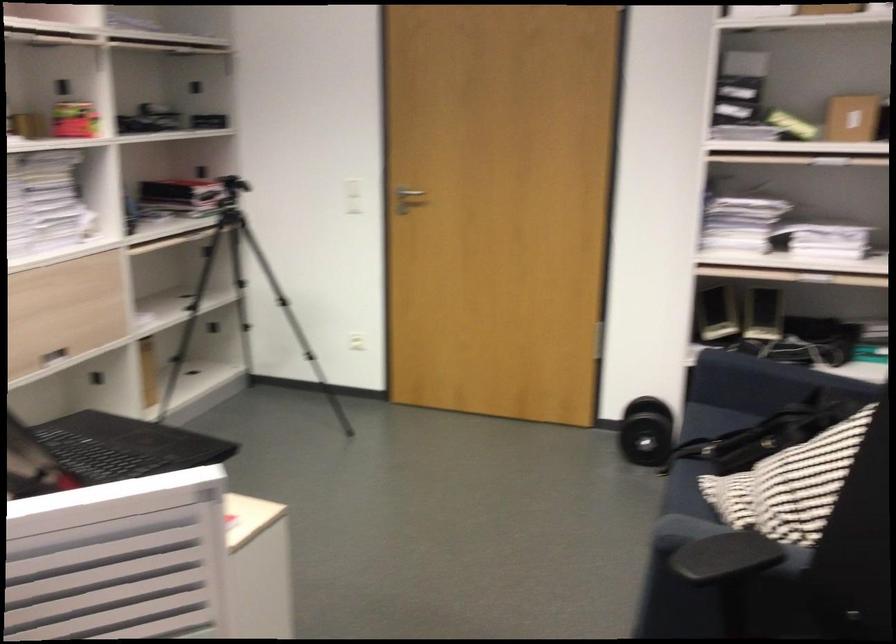
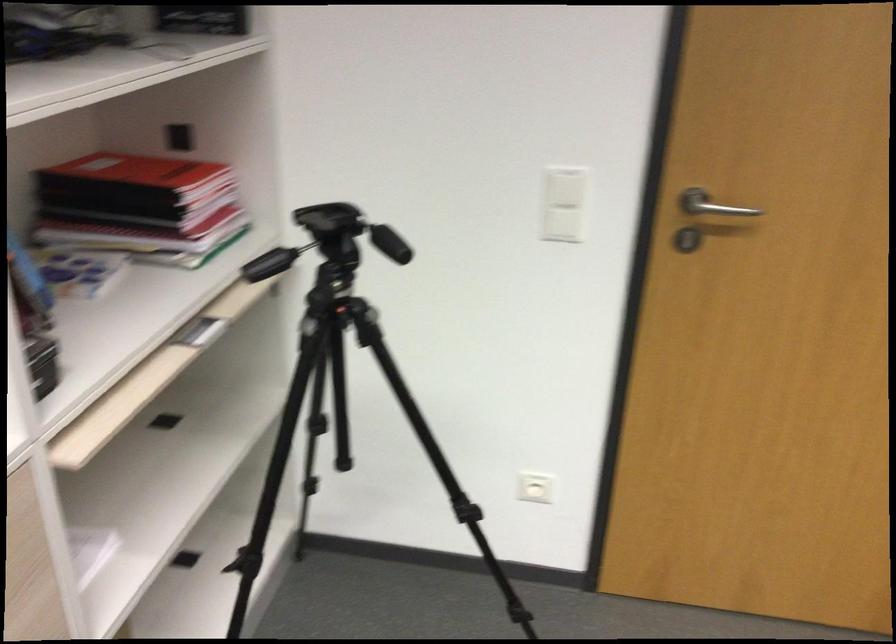
Locate, in the second image, the point that corresponds to point (359, 202) in the first image.

(563, 225)